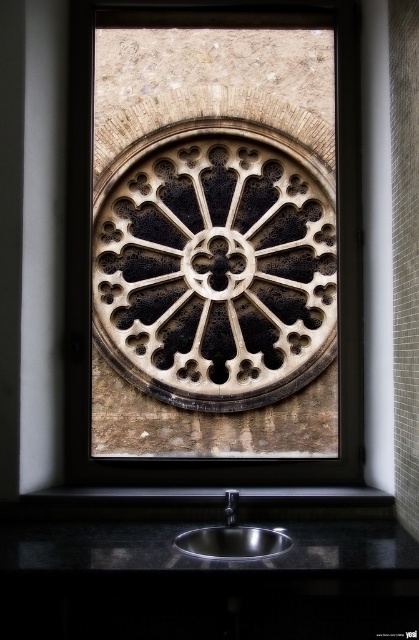
Can you confirm if polished stainless steel sink at lower center is wider than black metallic faucet at lower center?

Indeed, polished stainless steel sink at lower center has a greater width compared to black metallic faucet at lower center.

Locate an element on the screen. This screenshot has width=419, height=640. polished stainless steel sink at lower center is located at coordinates (232, 538).

Locate an element on the screen. polished stainless steel sink at lower center is located at coordinates (232, 538).

Between black stone rose window at center and black metallic faucet at lower center, which one has less height?

black metallic faucet at lower center is shorter.

Does point (287, 177) come farther from viewer compared to point (237, 493)?

Yes.

You are a GUI agent. You are given a task and a screenshot of the screen. Output one action in this format:
    pyautogui.click(x=<x>, y=<y>)
    Task: Click on the black stone rose window at center
    The height and width of the screenshot is (640, 419).
    Given the screenshot: What is the action you would take?
    214,243

Locate an element on the screen. This screenshot has height=640, width=419. black stone rose window at center is located at coordinates (214, 243).